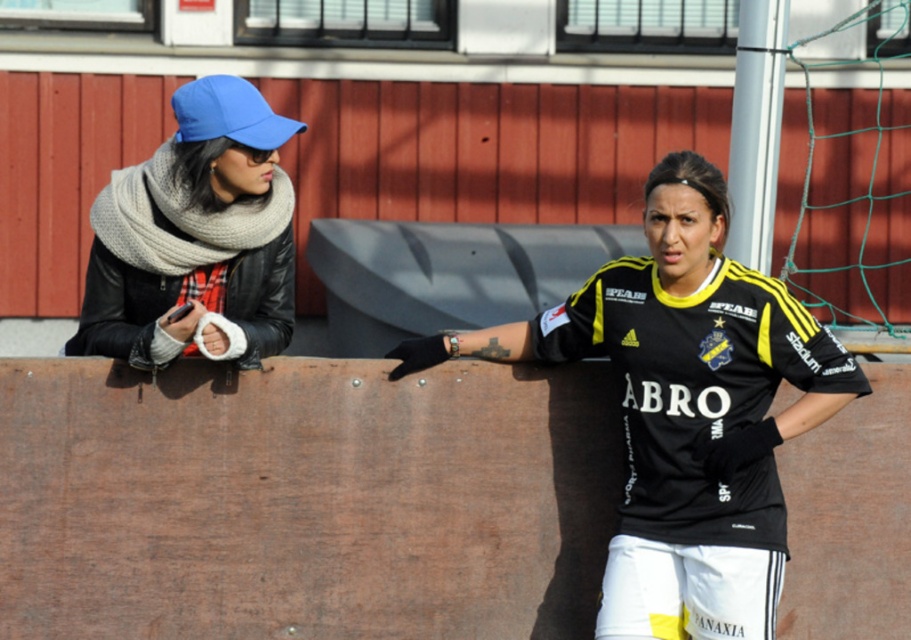
Who is positioned more to the left, black/yellow jersey at center or knitted gray scarf at left?

Positioned to the left is knitted gray scarf at left.

Consider the image. Who is shorter, black/yellow jersey at center or knitted gray scarf at left?

Standing shorter between the two is knitted gray scarf at left.

Does point (576, 321) come behind point (205, 109)?

Yes, point (576, 321) is farther from viewer.

The image size is (911, 640). What are the coordinates of `black/yellow jersey at center` in the screenshot? It's located at click(x=684, y=410).